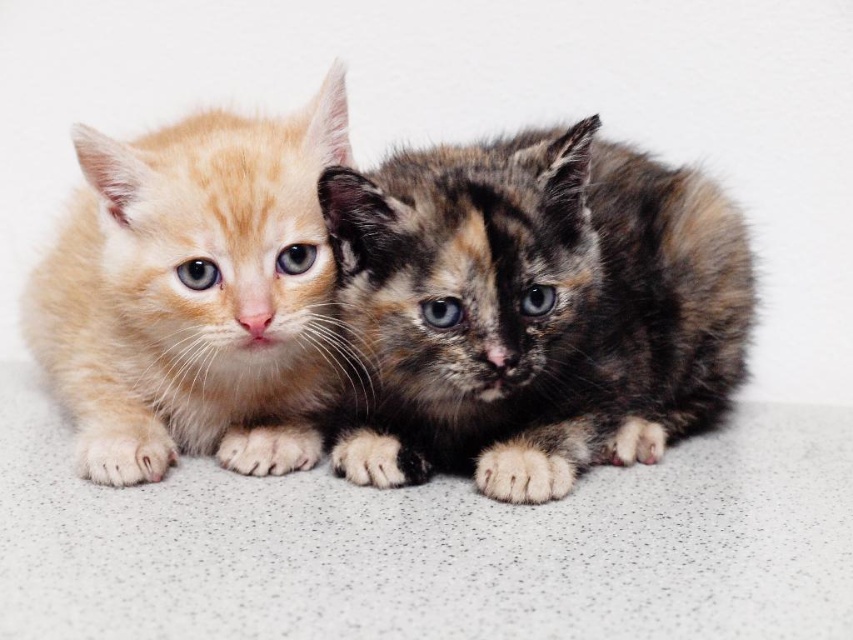
Question: Does calico fur kitten at center appear on the left side of matte orange kitten at left?

Choices:
 (A) yes
 (B) no

Answer: (B)

Question: Does calico fur kitten at center have a smaller size compared to matte orange kitten at left?

Choices:
 (A) yes
 (B) no

Answer: (B)

Question: Which of the following is the farthest from the observer?

Choices:
 (A) calico fur kitten at center
 (B) matte orange kitten at left

Answer: (B)

Question: Among these objects, which one is farthest from the camera?

Choices:
 (A) calico fur kitten at center
 (B) matte orange kitten at left

Answer: (B)

Question: Is the position of calico fur kitten at center less distant than that of matte orange kitten at left?

Choices:
 (A) no
 (B) yes

Answer: (B)